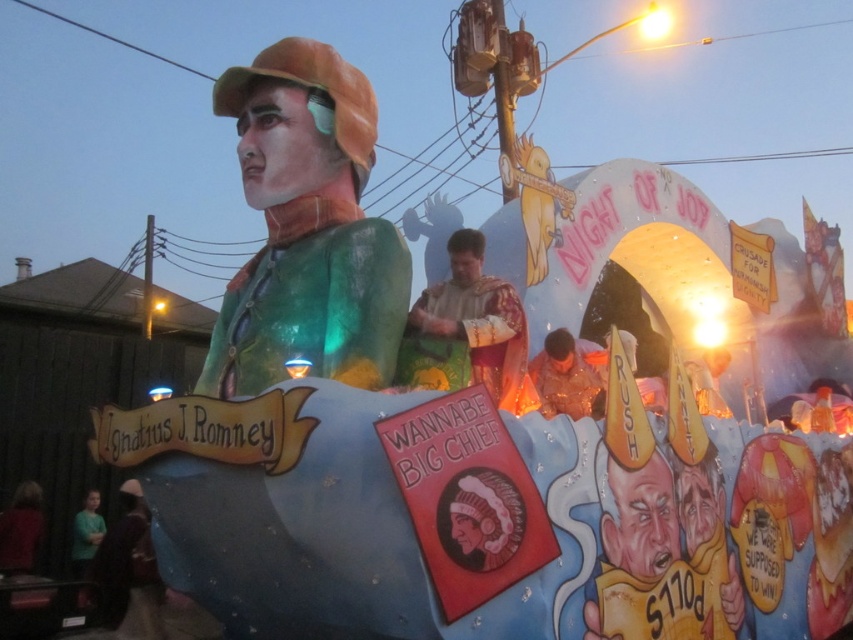
Question: Which of these objects is positioned farthest from the golden fabric robe at center?

Choices:
 (A) green translucent figure at center
 (B) shiny gold star at center

Answer: (B)

Question: Which is farther from the shiny gold star at center?

Choices:
 (A) green translucent figure at center
 (B) golden fabric robe at center

Answer: (A)

Question: Among these objects, which one is farthest from the camera?

Choices:
 (A) green translucent figure at center
 (B) golden fabric robe at center

Answer: (B)

Question: Can you confirm if green translucent figure at center is positioned to the right of golden fabric robe at center?

Choices:
 (A) no
 (B) yes

Answer: (A)

Question: Does green translucent figure at center appear on the right side of golden fabric robe at center?

Choices:
 (A) yes
 (B) no

Answer: (B)

Question: Observing the image, what is the correct spatial positioning of green translucent figure at center in reference to shiny gold star at center?

Choices:
 (A) right
 (B) left

Answer: (B)